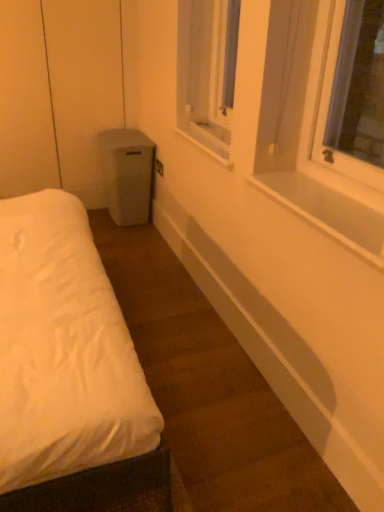
Question: Considering the relative sizes of white smooth window sill at upper right, which is counted as the first window sill, starting from the front, and clear plastic window screen at upper center in the image provided, is white smooth window sill at upper right, which is counted as the first window sill, starting from the front, wider than clear plastic window screen at upper center?

Choices:
 (A) yes
 (B) no

Answer: (A)

Question: Can you confirm if white smooth window sill at upper right, positioned as the second window sill in back-to-front order, is bigger than clear plastic window screen at upper center?

Choices:
 (A) yes
 (B) no

Answer: (B)

Question: From the image's perspective, is white smooth window sill at upper right, which is counted as the first window sill, starting from the front, above clear plastic window screen at upper center?

Choices:
 (A) yes
 (B) no

Answer: (B)

Question: From a real-world perspective, is white smooth window sill at upper right, positioned as the second window sill in back-to-front order, located beneath clear plastic window screen at upper center?

Choices:
 (A) yes
 (B) no

Answer: (A)

Question: Is white smooth window sill at upper right, positioned as the 1th window sill in bottom-to-top order, placed right next to clear plastic window screen at upper center?

Choices:
 (A) yes
 (B) no

Answer: (B)

Question: Is white smooth window sill at upper right, positioned as the 1th window sill in bottom-to-top order, at the left side of clear plastic window screen at upper center?

Choices:
 (A) yes
 (B) no

Answer: (B)

Question: Is white smooth window sill at upper right, positioned as the second window sill in back-to-front order, wider than white plastic window sill at center, placed as the 1th window sill when sorted from back to front?

Choices:
 (A) no
 (B) yes

Answer: (B)

Question: Is white smooth window sill at upper right, positioned as the second window sill in back-to-front order, placed right next to white plastic window sill at center, the 2th window sill when ordered from bottom to top?

Choices:
 (A) no
 (B) yes

Answer: (A)

Question: Can you confirm if white smooth window sill at upper right, positioned as the 1th window sill in bottom-to-top order, is positioned to the left of white plastic window sill at center, placed as the 1th window sill when sorted from back to front?

Choices:
 (A) yes
 (B) no

Answer: (B)

Question: Does white smooth window sill at upper right, positioned as the second window sill in back-to-front order, lie behind white plastic window sill at center, which ranks as the second window sill in front-to-back order?

Choices:
 (A) yes
 (B) no

Answer: (B)

Question: From the image's perspective, is white smooth window sill at upper right, which is the second window sill from top to bottom, on white plastic window sill at center, arranged as the first window sill when viewed from the top?

Choices:
 (A) no
 (B) yes

Answer: (A)

Question: Considering the relative sizes of white smooth window sill at upper right, which is counted as the first window sill, starting from the front, and white plastic window sill at center, arranged as the first window sill when viewed from the top, in the image provided, is white smooth window sill at upper right, which is counted as the first window sill, starting from the front, smaller than white plastic window sill at center, arranged as the first window sill when viewed from the top,?

Choices:
 (A) no
 (B) yes

Answer: (B)

Question: Is the position of clear plastic window screen at upper center less distant than that of white smooth window sill at upper right, which is counted as the first window sill, starting from the front?

Choices:
 (A) no
 (B) yes

Answer: (A)